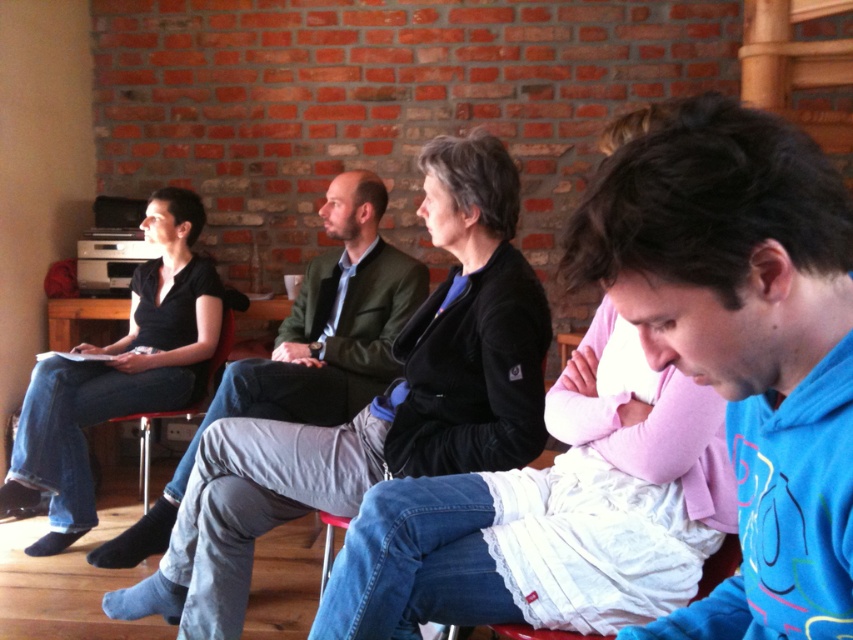
You are organizing a photo shoot and need to place a small prop between the blue fleece jacket at center and the matte black shirt at upper left. Given their sizes, which object should the prop be closer to to maintain visual balance?

The blue fleece jacket at center is smaller than the matte black shirt at upper left, so the prop should be placed closer to the blue fleece jacket at center to balance the visual weight.

You are organizing a small event and need to determine seating arrangements. You have a blue fleece jacket at center and a red plastic chair at left. Which object is narrower?

The blue fleece jacket at center is narrower than the red plastic chair at left.